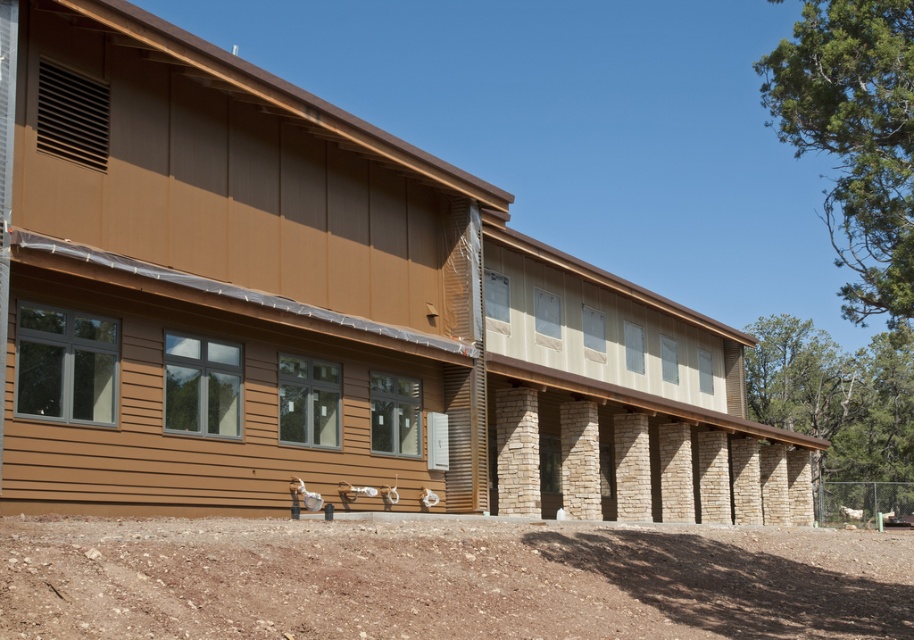
Who is positioned more to the left, brown wood siding at center or brown gravel at lower center?

From the viewer's perspective, brown gravel at lower center appears more on the left side.

Can you confirm if brown wood siding at center is wider than brown gravel at lower center?

Yes, brown wood siding at center is wider than brown gravel at lower center.

Is point (267, 356) closer to camera compared to point (607, 620)?

No.

Find the location of a particular element. brown wood siding at center is located at coordinates (319, 308).